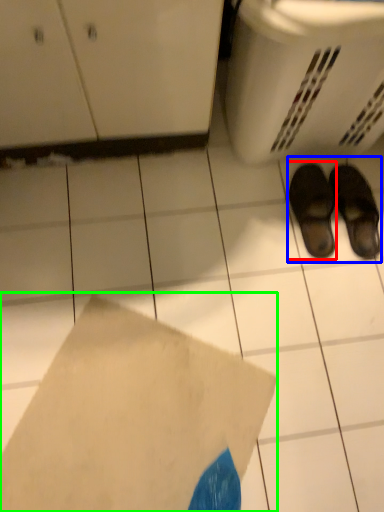
Question: Estimate the real-world distances between objects in this image. Which object is closer to footwear (highlighted by a red box), footwear (highlighted by a blue box) or envelope (highlighted by a green box)?

Choices:
 (A) footwear
 (B) envelope

Answer: (A)